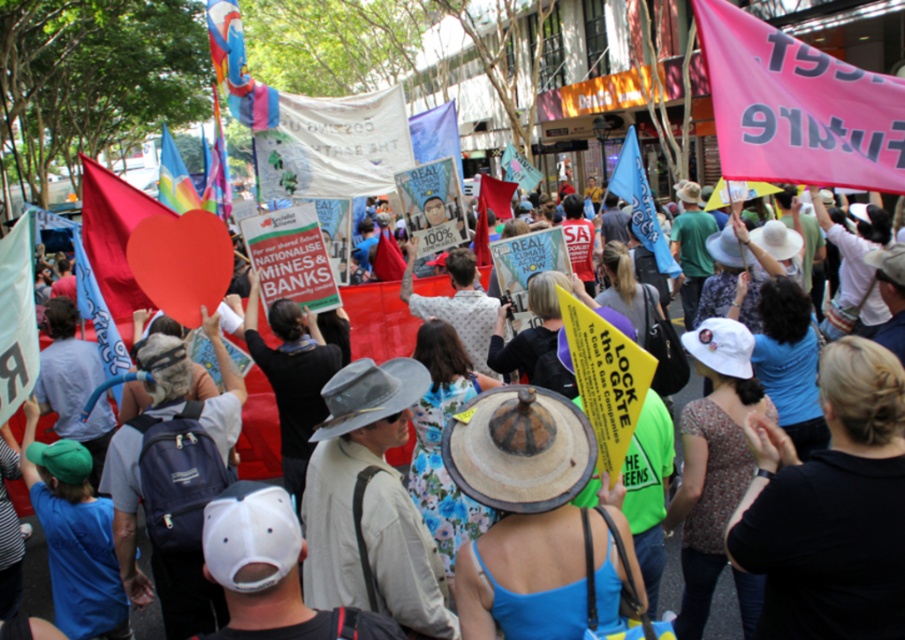
Can you confirm if yellow paper sign at center is taller than blue fabric flag at center?

Incorrect, yellow paper sign at center's height is not larger of blue fabric flag at center's.

At what (x,y) coordinates should I click in order to perform the action: click on yellow paper sign at center. Please return your answer as a coordinate pair (x, y). The width and height of the screenshot is (905, 640). Looking at the image, I should click on (378, 321).

In order to click on yellow paper sign at center in this screenshot , I will do `click(378, 321)`.

Is rainbow fabric flag at upper left closer to the viewer compared to pink fabric banner at center?

Yes, it is.

Can you confirm if rainbow fabric flag at upper left is positioned to the left of pink fabric banner at center?

Correct, you'll find rainbow fabric flag at upper left to the left of pink fabric banner at center.

Who is more forward, (170,154) or (539,177)?

Point (170,154)

Locate an element on the screen. The image size is (905, 640). rainbow fabric flag at upper left is located at coordinates (174, 177).

Does point (786, 35) come in front of point (643, 216)?

Yes, it is in front of point (643, 216).

Between pink fabric banner at upper right and blue fabric flag at center, which one appears on the left side from the viewer's perspective?

pink fabric banner at upper right

You are a GUI agent. You are given a task and a screenshot of the screen. Output one action in this format:
    pyautogui.click(x=<x>, y=<y>)
    Task: Click on the pink fabric banner at upper right
    The image size is (905, 640).
    Given the screenshot: What is the action you would take?
    pyautogui.click(x=797, y=108)